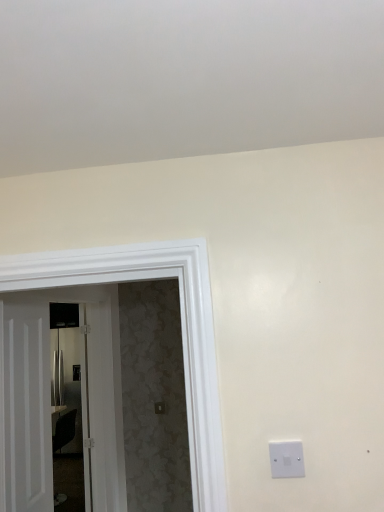
This screenshot has height=512, width=384. What do you see at coordinates (50, 397) in the screenshot? I see `white glossy door at left, acting as the second door starting from the left` at bounding box center [50, 397].

What do you see at coordinates (72, 410) in the screenshot? The height and width of the screenshot is (512, 384). I see `metallic silver refrigerator at left` at bounding box center [72, 410].

Identify the location of white plastic light switch at lower right. (286, 459).

Is metallic silver refrigerator at left directly adjacent to white glossy door at left, acting as the second door starting from the left?

Yes, metallic silver refrigerator at left is with white glossy door at left, acting as the second door starting from the left.

Which is correct: metallic silver refrigerator at left is inside white glossy door at left, acting as the second door starting from the left, or outside of it?

metallic silver refrigerator at left is not inside white glossy door at left, acting as the second door starting from the left, it's outside.

Could you tell me if metallic silver refrigerator at left is facing white glossy door at left, which appears as the first door when viewed from the right?

No, metallic silver refrigerator at left does not turn towards white glossy door at left, which appears as the first door when viewed from the right.

Which object is wider, white wooden door at left, the second door viewed from the right, or white glossy door at left, which appears as the first door when viewed from the right?

Wider between the two is white glossy door at left, which appears as the first door when viewed from the right.

Is point (0, 477) behind point (102, 392)?

That is False.

Considering the sizes of objects white wooden door at left, the second door viewed from the right, and white glossy door at left, acting as the second door starting from the left, in the image provided, who is shorter, white wooden door at left, the second door viewed from the right, or white glossy door at left, acting as the second door starting from the left,?

white wooden door at left, the second door viewed from the right, is shorter.

From a real-world perspective, between white wooden door at left, arranged as the first door when viewed from the left, and white glossy door at left, which appears as the first door when viewed from the right, who is vertically lower?

In real-world perspective, white glossy door at left, which appears as the first door when viewed from the right, is lower.

From the image's perspective, is white wooden door at left, arranged as the first door when viewed from the left, below white plastic light switch at lower right?

Yes, from the image's perspective, white wooden door at left, arranged as the first door when viewed from the left, is beneath white plastic light switch at lower right.

From a real-world perspective, is white wooden door at left, arranged as the first door when viewed from the left, below white plastic light switch at lower right?

Correct, in the physical world, white wooden door at left, arranged as the first door when viewed from the left, is lower than white plastic light switch at lower right.

At what (x,y) coordinates should I click in order to perform the action: click on light switch lying above the white wooden door at left, the second door viewed from the right (from the image's perspective). Please return your answer as a coordinate pair (x, y). This screenshot has height=512, width=384. Looking at the image, I should click on (286, 459).

Considering the positions of point (291, 450) and point (8, 404), is point (291, 450) closer or farther from the camera than point (8, 404)?

Point (291, 450) appears to be closer to the viewer than point (8, 404).

Can you confirm if white plastic light switch at lower right is smaller than white glossy door at left, acting as the second door starting from the left?

Yes, white plastic light switch at lower right is smaller than white glossy door at left, acting as the second door starting from the left.

Is white plastic light switch at lower right wider or thinner than white glossy door at left, acting as the second door starting from the left?

white plastic light switch at lower right is thinner than white glossy door at left, acting as the second door starting from the left.

Is white plastic light switch at lower right taller or shorter than white glossy door at left, acting as the second door starting from the left?

In the image, white plastic light switch at lower right appears to be shorter than white glossy door at left, acting as the second door starting from the left.

From a real-world perspective, is white wooden door at left, arranged as the first door when viewed from the left, positioned above or below metallic silver refrigerator at left?

white wooden door at left, arranged as the first door when viewed from the left, is situated higher than metallic silver refrigerator at left in the real world.

Is metallic silver refrigerator at left a part of white wooden door at left, the second door viewed from the right?

No.

Which is more to the right, white wooden door at left, arranged as the first door when viewed from the left, or metallic silver refrigerator at left?

Positioned to the right is white wooden door at left, arranged as the first door when viewed from the left.

Is white wooden door at left, the second door viewed from the right, looking in the opposite direction of metallic silver refrigerator at left?

No, white wooden door at left, the second door viewed from the right, is not facing away from metallic silver refrigerator at left.

Who is taller, white plastic light switch at lower right or metallic silver refrigerator at left?

metallic silver refrigerator at left.

Does white plastic light switch at lower right have a smaller size compared to metallic silver refrigerator at left?

Indeed, white plastic light switch at lower right has a smaller size compared to metallic silver refrigerator at left.

Does white plastic light switch at lower right have a greater width compared to metallic silver refrigerator at left?

No, white plastic light switch at lower right is not wider than metallic silver refrigerator at left.

Is metallic silver refrigerator at left not inside white plastic light switch at lower right?

Yes.

Could you tell me if metallic silver refrigerator at left is facing white plastic light switch at lower right?

No, metallic silver refrigerator at left is not turned towards white plastic light switch at lower right.

Between metallic silver refrigerator at left and white plastic light switch at lower right, which one has larger size?

metallic silver refrigerator at left is bigger.

Which is in front, point (69, 395) or point (298, 460)?

The point (298, 460) is closer.

From a real-world perspective, which door is the 1st one above the metallic silver refrigerator at left? Please provide its 2D coordinates.

[(50, 397)]

This screenshot has width=384, height=512. Find the location of `door that appears in front of the white wooden door at left, the second door viewed from the right`. door that appears in front of the white wooden door at left, the second door viewed from the right is located at coordinates pyautogui.click(x=50, y=397).

Which object lies further to the anchor point white plastic light switch at lower right, white glossy door at left, which appears as the first door when viewed from the right, or white wooden door at left, the second door viewed from the right?

white glossy door at left, which appears as the first door when viewed from the right, is positioned further to the anchor white plastic light switch at lower right.

Estimate the real-world distances between objects in this image. Which object is further from white glossy door at left, acting as the second door starting from the left, white wooden door at left, arranged as the first door when viewed from the left, or metallic silver refrigerator at left?

Based on the image, white wooden door at left, arranged as the first door when viewed from the left, appears to be further to white glossy door at left, acting as the second door starting from the left.

Which object lies nearer to the anchor point white plastic light switch at lower right, white wooden door at left, the second door viewed from the right, or white glossy door at left, acting as the second door starting from the left?

white wooden door at left, the second door viewed from the right.

When comparing their distances from white wooden door at left, arranged as the first door when viewed from the left, does white glossy door at left, which appears as the first door when viewed from the right, or white plastic light switch at lower right seem closer?

Based on the image, white glossy door at left, which appears as the first door when viewed from the right, appears to be nearer to white wooden door at left, arranged as the first door when viewed from the left.

Which object lies nearer to the anchor point white glossy door at left, acting as the second door starting from the left, white plastic light switch at lower right or metallic silver refrigerator at left?

metallic silver refrigerator at left lies closer to white glossy door at left, acting as the second door starting from the left, than the other object.

From the image, which object appears to be nearer to metallic silver refrigerator at left, white wooden door at left, arranged as the first door when viewed from the left, or white plastic light switch at lower right?

white wooden door at left, arranged as the first door when viewed from the left, is positioned closer to the anchor metallic silver refrigerator at left.

When comparing their distances from white plastic light switch at lower right, does metallic silver refrigerator at left or white glossy door at left, which appears as the first door when viewed from the right, seem further?

Among the two, metallic silver refrigerator at left is located further to white plastic light switch at lower right.

Based on their spatial positions, is white plastic light switch at lower right or metallic silver refrigerator at left further from white wooden door at left, arranged as the first door when viewed from the left?

white plastic light switch at lower right is positioned further to the anchor white wooden door at left, arranged as the first door when viewed from the left.

You are a GUI agent. You are given a task and a screenshot of the screen. Output one action in this format:
    pyautogui.click(x=<x>, y=<y>)
    Task: Click on the door between white wooden door at left, arranged as the first door when viewed from the left, and white plastic light switch at lower right
    This screenshot has width=384, height=512.
    Given the screenshot: What is the action you would take?
    pyautogui.click(x=50, y=397)

Where is `door positioned between white glossy door at left, which appears as the first door when viewed from the right, and metallic silver refrigerator at left from near to far`? The height and width of the screenshot is (512, 384). door positioned between white glossy door at left, which appears as the first door when viewed from the right, and metallic silver refrigerator at left from near to far is located at coordinates (25, 407).